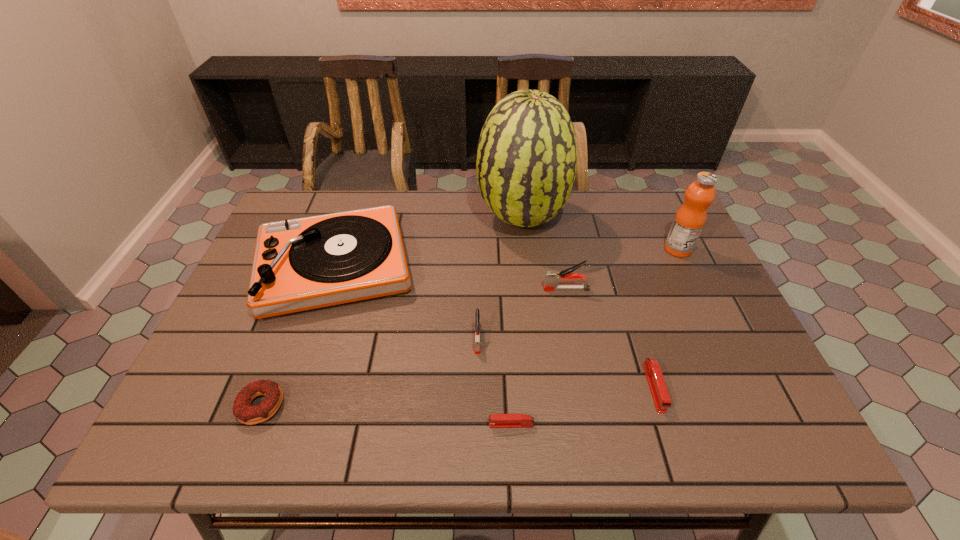
The height and width of the screenshot is (540, 960). I want to click on free space located 0.060m on the handle side of the fifth farthest object, so click(477, 376).

You are a GUI agent. You are given a task and a screenshot of the screen. Output one action in this format:
    pyautogui.click(x=<x>, y=<y>)
    Task: Click on the blank space located on the front-facing side of the third farthest stapler
    This screenshot has width=960, height=540.
    Given the screenshot: What is the action you would take?
    pyautogui.click(x=673, y=447)

I want to click on vacant region located 0.170m on the right of the chocolate doughnut, so click(365, 406).

At what (x,y) coordinates should I click in order to perform the action: click on vacant point located on the front-facing side of the nearest stapler. Please return your answer as a coordinate pair (x, y). The height and width of the screenshot is (540, 960). Looking at the image, I should click on (326, 424).

The height and width of the screenshot is (540, 960). In order to click on free space located 0.190m on the front-facing side of the nearest stapler in this screenshot , I will do `click(396, 424)`.

Where is `vacant space situated 0.140m on the front-facing side of the nearest stapler`? The image size is (960, 540). vacant space situated 0.140m on the front-facing side of the nearest stapler is located at coordinates (420, 424).

Where is `watermelon located in the far edge section of the desktop`? The image size is (960, 540). watermelon located in the far edge section of the desktop is located at coordinates (526, 163).

Find the location of `record player at the far edge`. record player at the far edge is located at coordinates (300, 264).

You are a GUI agent. You are given a task and a screenshot of the screen. Output one action in this format:
    pyautogui.click(x=<x>, y=<y>)
    Task: Click on the doughnut located in the near edge section of the desktop
    This screenshot has height=540, width=960.
    Given the screenshot: What is the action you would take?
    pyautogui.click(x=245, y=413)

Where is `record player located in the left edge section of the desktop`? This screenshot has height=540, width=960. record player located in the left edge section of the desktop is located at coordinates (300, 264).